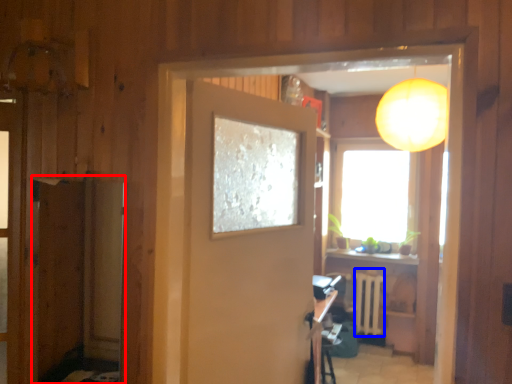
Question: Among these objects, which one is nearest to the camera, screen door (highlighted by a red box) or radiator (highlighted by a blue box)?

Choices:
 (A) screen door
 (B) radiator

Answer: (A)